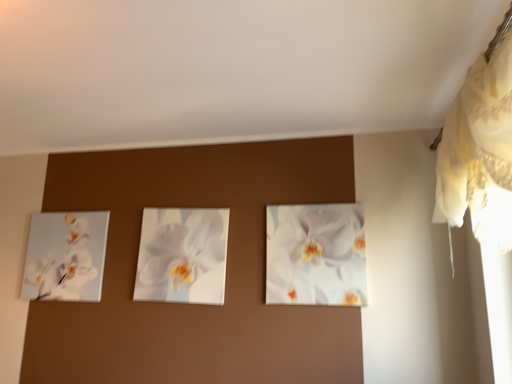
Question: Does white glossy orchid at center, which appears as the 2th flower when viewed from the left, turn towards white glossy orchid at center, marked as the 2th flower in a right-to-left arrangement?

Choices:
 (A) yes
 (B) no

Answer: (B)

Question: From a real-world perspective, is white glossy orchid at center, which appears as the 2th flower when viewed from the left, over white glossy orchid at center, which appears as the first flower when viewed from the left?

Choices:
 (A) yes
 (B) no

Answer: (A)

Question: From the image's perspective, is white glossy orchid at center, which appears as the 2th flower when viewed from the left, under white glossy orchid at center, which appears as the first flower when viewed from the left?

Choices:
 (A) yes
 (B) no

Answer: (B)

Question: Are white glossy orchid at center, which appears as the 2th flower when viewed from the left, and white glossy orchid at center, marked as the 2th flower in a right-to-left arrangement, located far from each other?

Choices:
 (A) no
 (B) yes

Answer: (A)

Question: Is white glossy orchid at center, which is counted as the first flower, starting from the right, surrounding white glossy orchid at center, which appears as the first flower when viewed from the left?

Choices:
 (A) yes
 (B) no

Answer: (B)

Question: Is white glossy orchid at center, which appears as the 2th flower when viewed from the left, next to white glossy orchid at center, which appears as the first flower when viewed from the left, and touching it?

Choices:
 (A) yes
 (B) no

Answer: (B)

Question: Does white glossy orchid painting at left have a lesser width compared to white lace curtain at upper right?

Choices:
 (A) no
 (B) yes

Answer: (B)

Question: Is white glossy orchid painting at left next to white lace curtain at upper right?

Choices:
 (A) no
 (B) yes

Answer: (A)

Question: Is white glossy orchid painting at left wider than white lace curtain at upper right?

Choices:
 (A) no
 (B) yes

Answer: (A)

Question: From a real-world perspective, is white glossy orchid painting at left below white lace curtain at upper right?

Choices:
 (A) no
 (B) yes

Answer: (B)

Question: Could you tell me if white glossy orchid painting at left is facing white lace curtain at upper right?

Choices:
 (A) yes
 (B) no

Answer: (B)

Question: From a real-world perspective, is white glossy orchid painting at left located higher than white lace curtain at upper right?

Choices:
 (A) no
 (B) yes

Answer: (A)

Question: From the image's perspective, is white glossy orchid at center, marked as the 2th flower in a right-to-left arrangement, beneath white glossy orchid painting at left?

Choices:
 (A) no
 (B) yes

Answer: (A)